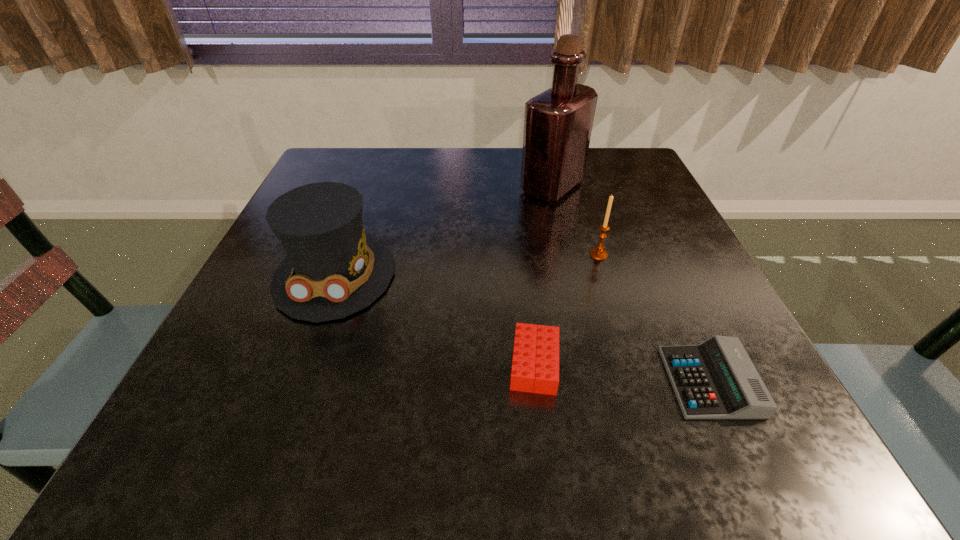
Where is `the farthest object`? the farthest object is located at coordinates (558, 123).

Where is `the tallest object`? This screenshot has width=960, height=540. the tallest object is located at coordinates (558, 123).

At what (x,y) coordinates should I click in order to perform the action: click on the leftmost object. Please return your answer as a coordinate pair (x, y). The height and width of the screenshot is (540, 960). Looking at the image, I should click on (332, 269).

This screenshot has width=960, height=540. Identify the location of candle_holder. (599, 253).

At what (x,y) coordinates should I click in order to perform the action: click on the fourth tallest object. Please return your answer as a coordinate pair (x, y). Looking at the image, I should click on (535, 367).

The width and height of the screenshot is (960, 540). Identify the location of calculator. (716, 379).

Locate an element on the screen. The height and width of the screenshot is (540, 960). the shortest object is located at coordinates (716, 379).

I want to click on vacant area situated 0.090m on the front of the tallest object, so click(562, 230).

Locate an element on the screen. Image resolution: width=960 pixels, height=540 pixels. blank area located with goggles on the front of the leftmost object is located at coordinates pyautogui.click(x=300, y=369).

Locate an element on the screen. The width and height of the screenshot is (960, 540). vacant space situated 0.160m on the left of the candle_holder is located at coordinates (508, 255).